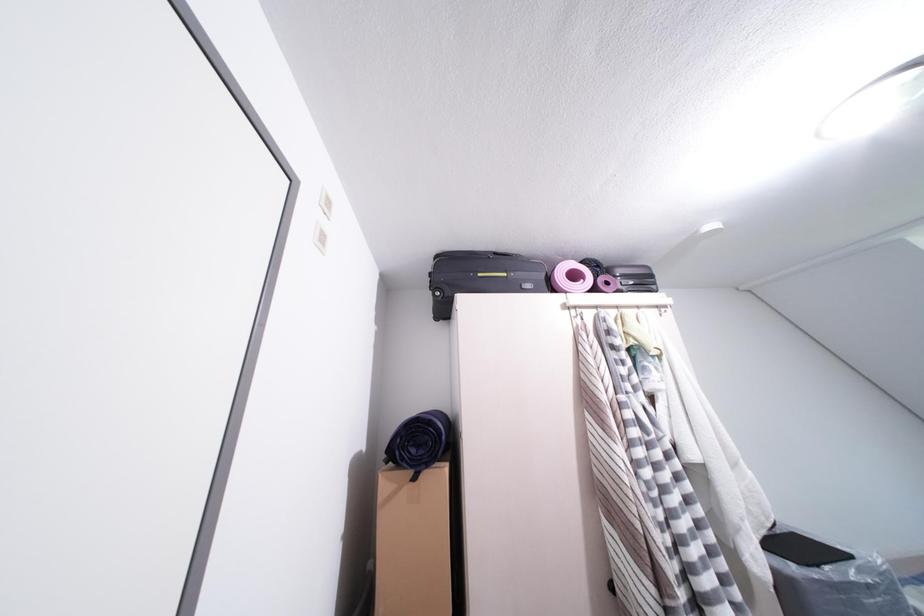
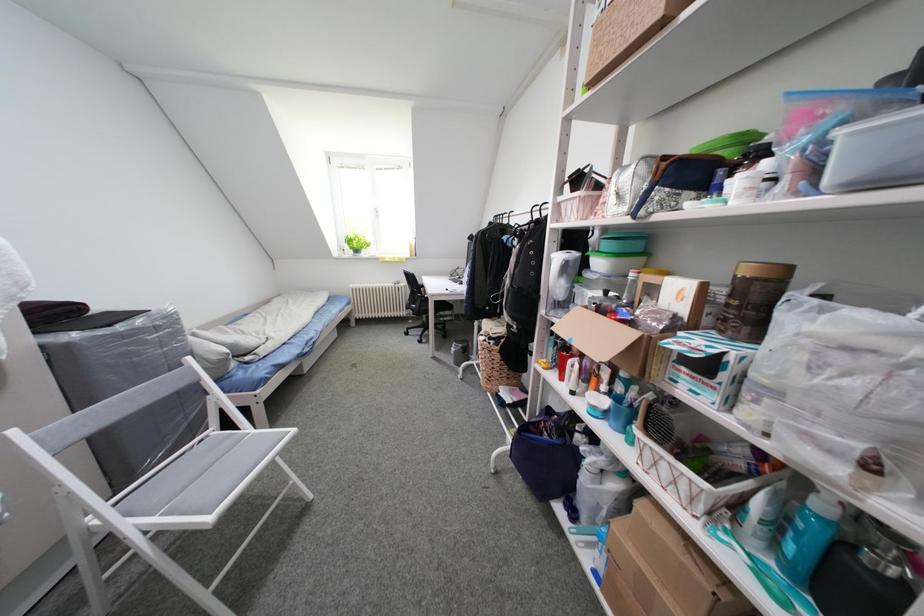
Question: The images are taken continuously from a first-person perspective. In which direction is your viewpoint rotating?

Choices:
 (A) Left
 (B) Right
 (C) Up
 (D) Down

Answer: (B)